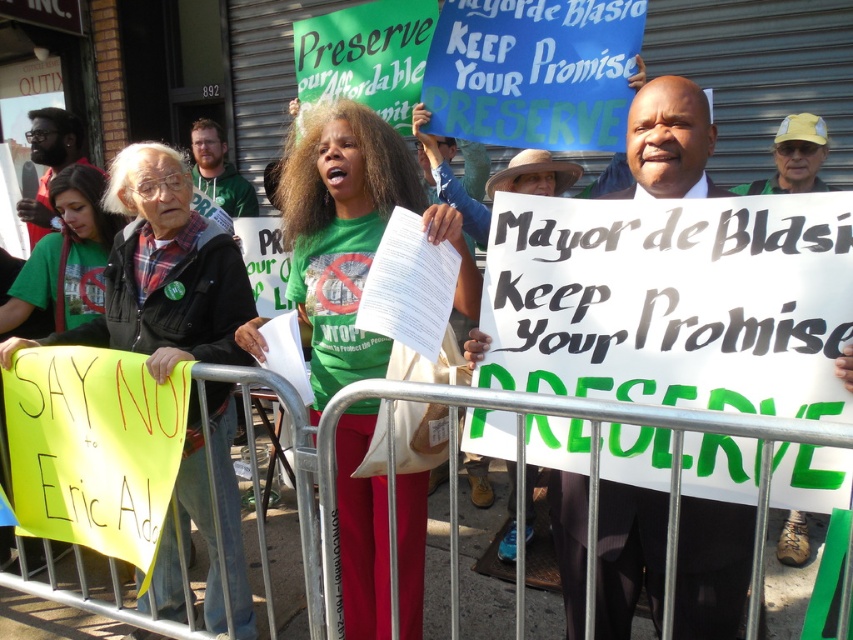
Question: Which point is closer to the camera?

Choices:
 (A) green fabric shirt at lower left
 (B) green fabric shirt at center
 (C) white paper sign at center

Answer: (C)

Question: Which of these objects is positioned closest to the green fabric shirt at center?

Choices:
 (A) green fabric shirt at lower left
 (B) white paper sign at center

Answer: (B)

Question: Can you confirm if green fabric shirt at center is positioned to the right of white paper sign at center?

Choices:
 (A) no
 (B) yes

Answer: (A)

Question: Where is white paper sign at center located in relation to green fabric shirt at lower left in the image?

Choices:
 (A) below
 (B) above

Answer: (A)

Question: Which object appears closest to the camera in this image?

Choices:
 (A) green fabric shirt at lower left
 (B) green fabric shirt at center
 (C) white paper sign at center

Answer: (C)

Question: Is green fabric shirt at center in front of white paper sign at center?

Choices:
 (A) yes
 (B) no

Answer: (B)